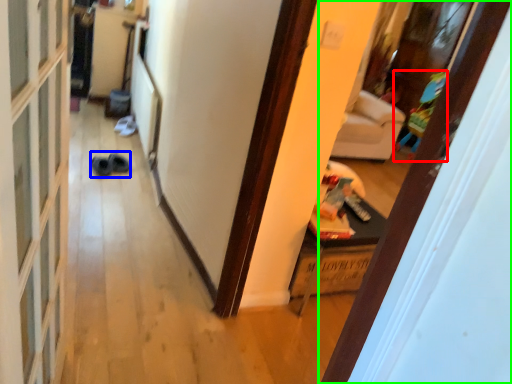
Question: Which object is the closest to the toy (highlighted by a red box)? Choose among these: shoe (highlighted by a blue box) or door (highlighted by a green box).

Choices:
 (A) shoe
 (B) door

Answer: (A)